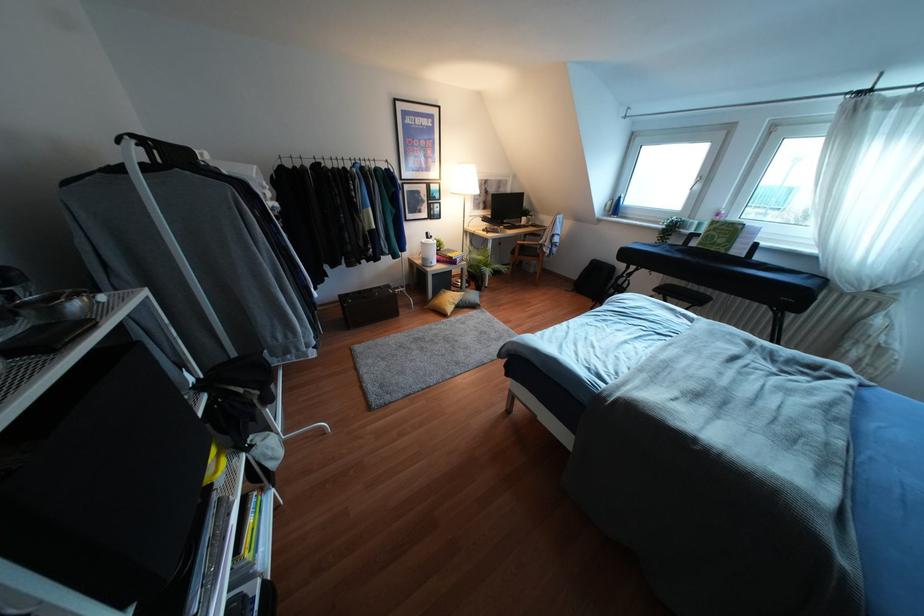
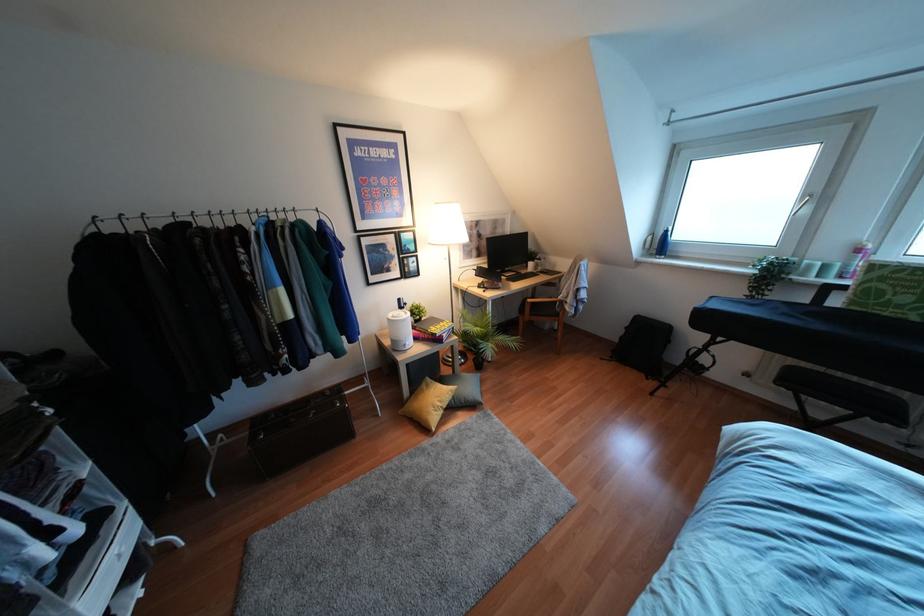
Where in the second image is the point corresponding to (x=614, y=208) from the first image?

(660, 245)